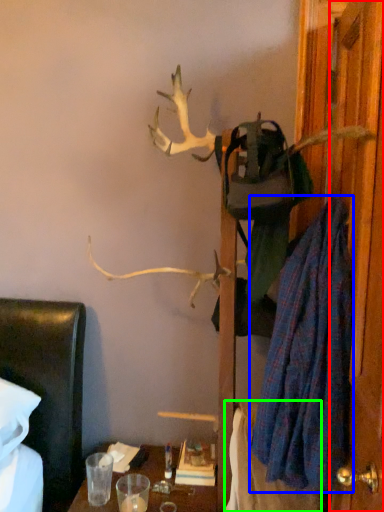
Question: Which object is positioned closest to door (highlighted by a red box)? Select from robe (highlighted by a blue box) and blanket (highlighted by a green box).

Choices:
 (A) robe
 (B) blanket

Answer: (A)